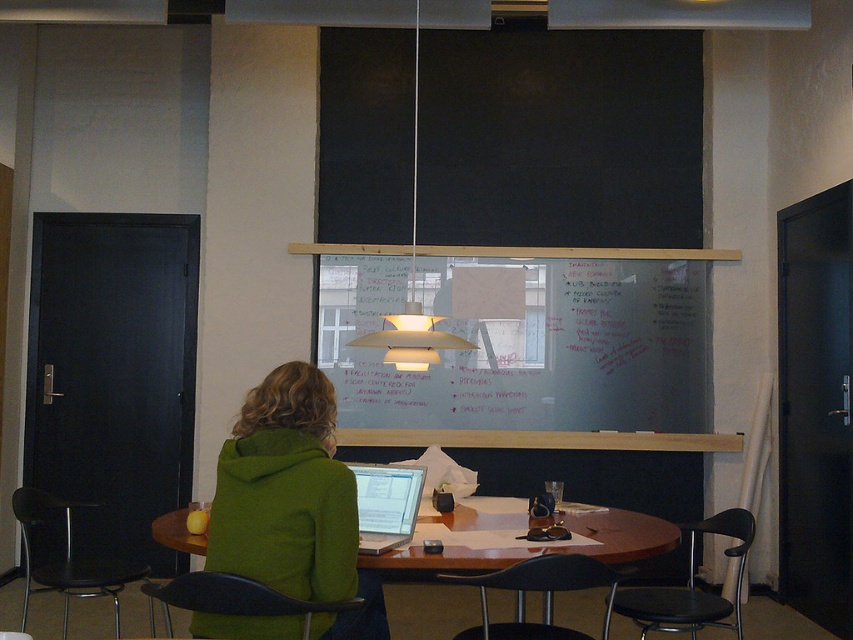
Does point (548, 266) come in front of point (569, 628)?

No, it is not.

Can you confirm if transparent glass whiteboard at center is smaller than black plastic chair at lower center?

Actually, transparent glass whiteboard at center might be larger than black plastic chair at lower center.

Measure the distance between point (457, 353) and camera.

The distance of point (457, 353) from camera is 18.73 feet.

Locate an element on the screen. transparent glass whiteboard at center is located at coordinates (521, 346).

Which is above, transparent glass whiteboard at center or silver metallic laptop at center?

Positioned higher is transparent glass whiteboard at center.

Is transparent glass whiteboard at center bigger than silver metallic laptop at center?

Yes, transparent glass whiteboard at center is bigger than silver metallic laptop at center.

Is point (489, 250) less distant than point (387, 470)?

No, (489, 250) is further to viewer.

The height and width of the screenshot is (640, 853). I want to click on transparent glass whiteboard at center, so click(521, 346).

Consider the image. Who is more forward, (65,499) or (421,468)?

Positioned in front is point (421,468).

In the scene shown: Which of these two, black plastic chair at left or silver metallic laptop at center, stands taller?

black plastic chair at left

Is point (48, 496) positioned in front of point (363, 552)?

No, it is behind (363, 552).

Where is `black plastic chair at left`? The height and width of the screenshot is (640, 853). black plastic chair at left is located at coordinates (67, 557).